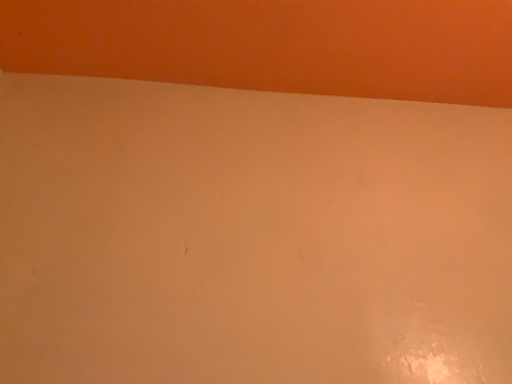
Describe the element at coordinates (274, 45) in the screenshot. The height and width of the screenshot is (384, 512). I see `matte orange wall at upper center` at that location.

Identify the location of matte orange wall at upper center. This screenshot has width=512, height=384. (274, 45).

What is the approximate height of matte orange wall at upper center?

matte orange wall at upper center is 0.93 inches in height.

Measure the distance between point (184, 54) and camera.

Point (184, 54) and camera are 37.68 inches apart from each other.

Where is `matte orange wall at upper center`? matte orange wall at upper center is located at coordinates (274, 45).